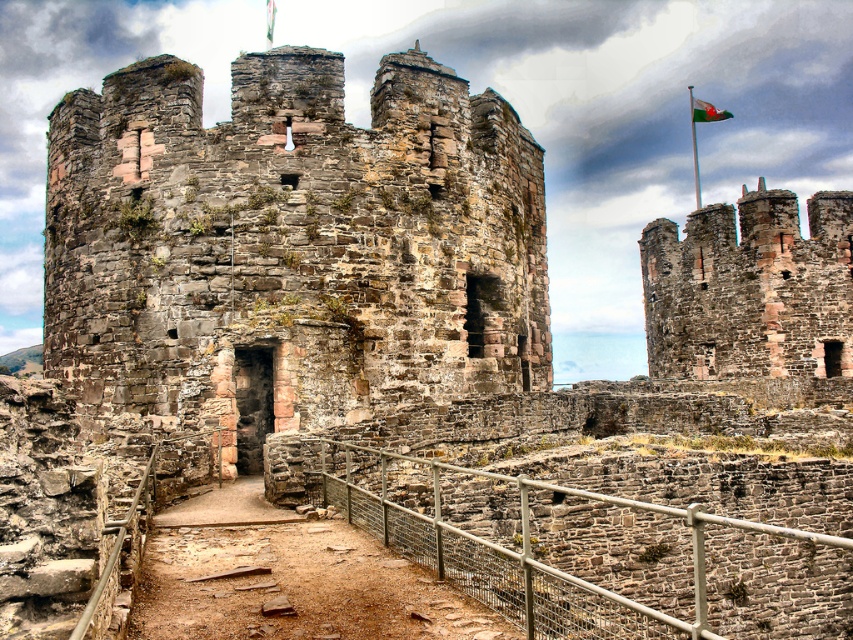
What do you see at coordinates (289, 248) in the screenshot?
I see `rusty stone castle at center` at bounding box center [289, 248].

Is point (131, 145) in front of point (724, 118)?

Yes, point (131, 145) is closer to viewer.

Find the location of `rusty stone castle at center`. rusty stone castle at center is located at coordinates (289, 248).

Who is taller, rusty stone castle at center or rustic stone wall at upper right?

With more height is rusty stone castle at center.

Does rusty stone castle at center appear under rustic stone wall at upper right?

Actually, rusty stone castle at center is above rustic stone wall at upper right.

Describe the element at coordinates (289, 248) in the screenshot. I see `rusty stone castle at center` at that location.

This screenshot has height=640, width=853. Find the location of `rusty stone castle at center`. rusty stone castle at center is located at coordinates (289, 248).

Does rustic stone wall at upper right appear over green fabric flag at upper right?

No, rustic stone wall at upper right is not above green fabric flag at upper right.

Between point (747, 234) and point (712, 115), which one is positioned in front?

Point (747, 234)

The width and height of the screenshot is (853, 640). I want to click on rustic stone wall at upper right, so click(750, 289).